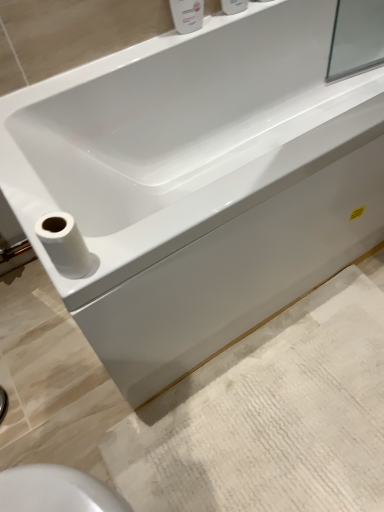
Question: Is white glossy soap dispenser at upper center, which is the 2th toiletry from right to left, inside or outside of white textured bath mat at lower right?

Choices:
 (A) outside
 (B) inside

Answer: (A)

Question: Considering the relative positions of white glossy soap dispenser at upper center, which is the 2th toiletry from right to left, and white textured bath mat at lower right in the image provided, is white glossy soap dispenser at upper center, which is the 2th toiletry from right to left, to the left or to the right of white textured bath mat at lower right?

Choices:
 (A) right
 (B) left

Answer: (B)

Question: Based on their relative distances, which object is farther from the white glossy soap dispenser at upper center, the first toiletry when ordered from left to right?

Choices:
 (A) white textured bath mat at lower right
 (B) white glossy bottle at upper center, which appears as the 2th toiletry when viewed from the left
 (C) white matte toilet paper at lower left

Answer: (A)

Question: Which object is the closest to the white textured bath mat at lower right?

Choices:
 (A) white matte toilet paper at lower left
 (B) white glossy soap dispenser at upper center, the first toiletry when ordered from left to right
 (C) white glossy bottle at upper center, the 1th toiletry viewed from the right

Answer: (A)